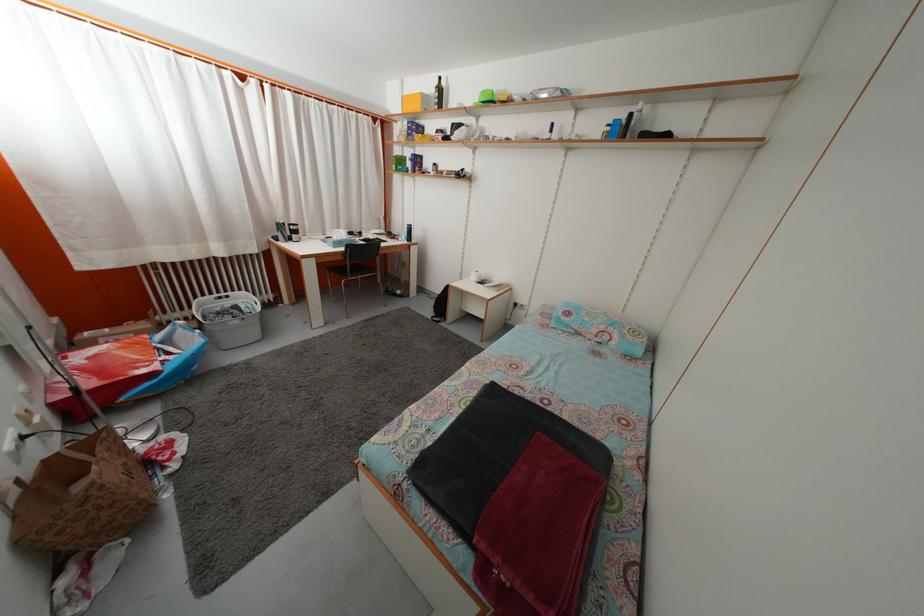
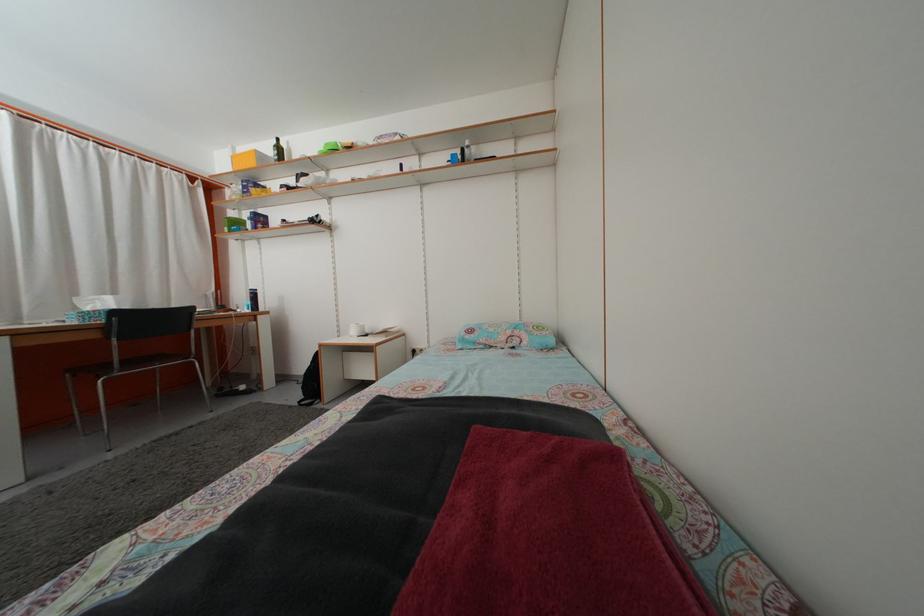
In the second image, find the point that corresponds to point 341,245 in the first image.

(94, 317)